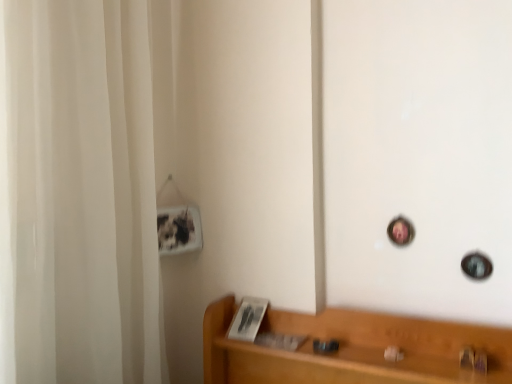
Find the location of a particular element. The image size is (512, 384). free location to the left of metallic gold door handle at lower right is located at coordinates (417, 366).